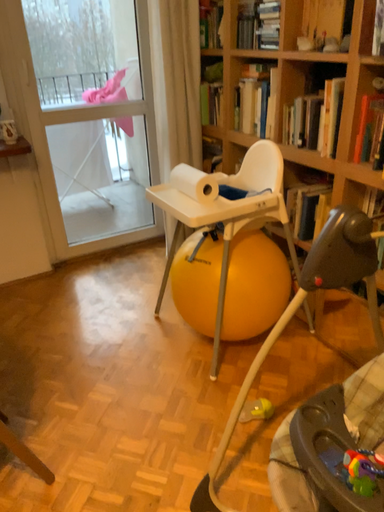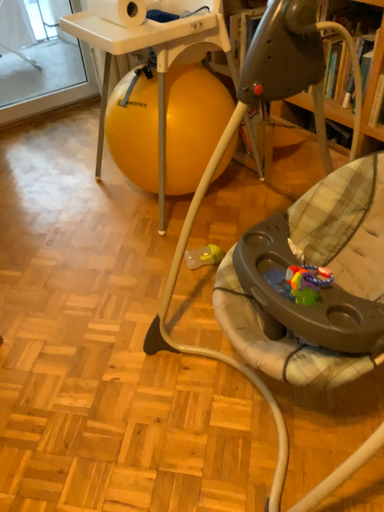
Question: Which way did the camera rotate in the video?

Choices:
 (A) rotated upward
 (B) rotated downward

Answer: (B)